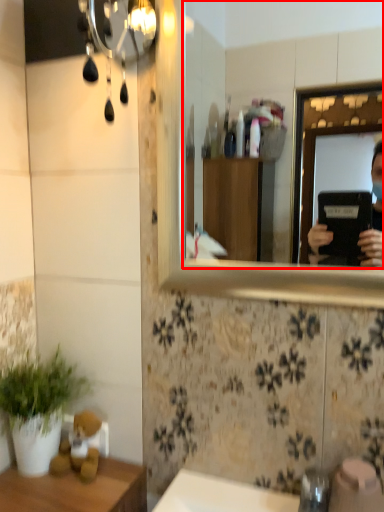
Question: In this image, where is mirror (annotated by the red box) located relative to houseplant?

Choices:
 (A) right
 (B) left

Answer: (A)